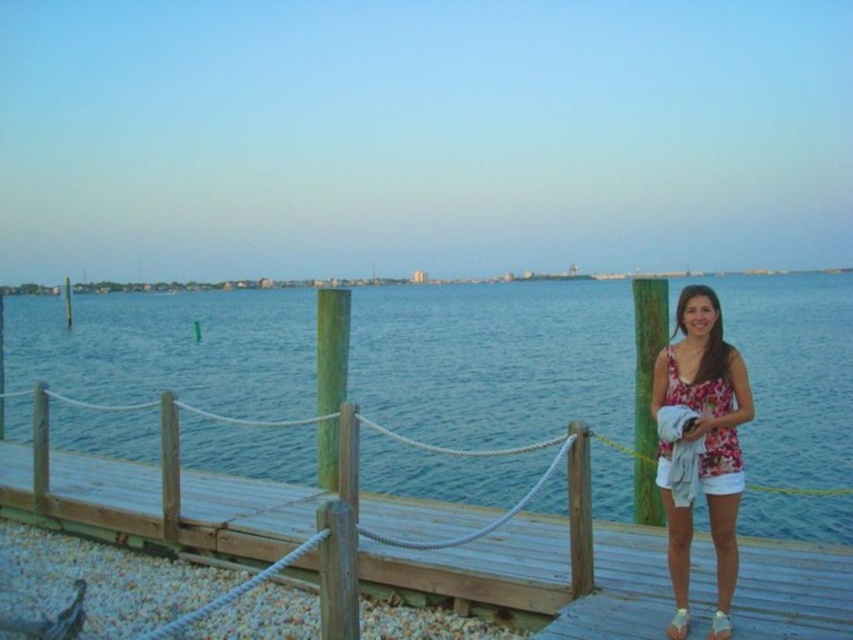
Looking at this image, you are standing on the wooden pier and want to walk towards the point labeled point (33,358). Which direction should you walk relative to point (732,369)?

You should walk towards the point labeled point (33,358), which is behind point (732,369), meaning you need to move in the direction away from the edge of the pier towards the shore.

Based on the photo, you are standing on the wooden pier and want to walk towards the water. You see two points marked on the pier, point 1 at coordinates point (695, 579) and point 2 at coordinates point (693, 387). Which point is closer to you as you face the water?

Point 1 at coordinates point (695, 579) is closer to you because it is further to the viewer than point 2 at coordinates point (693, 387).